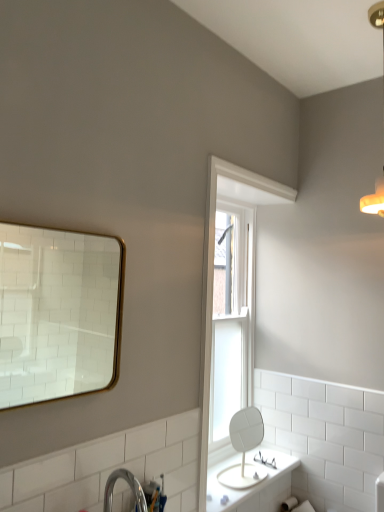
Question: Considering their positions, is warm matte light fixture at upper right located in front of or behind white painted wood window frame at upper center?

Choices:
 (A) front
 (B) behind

Answer: (A)

Question: Is point (382, 206) closer or farther from the camera than point (203, 408)?

Choices:
 (A) closer
 (B) farther

Answer: (B)

Question: Estimate the real-world distances between objects in this image. Which object is closer to the warm matte light fixture at upper right?

Choices:
 (A) gold-framed mirror at upper left, the 1th mirror when ordered from left to right
 (B) clear plastic glasses at center
 (C) white glossy mirror at center, acting as the first mirror starting from the right
 (D) clear glass window at center
 (E) white painted wood window frame at upper center

Answer: (E)

Question: Estimate the real-world distances between objects in this image. Which object is farther from the white painted wood window frame at upper center?

Choices:
 (A) clear glass window at center
 (B) warm matte light fixture at upper right
 (C) clear plastic glasses at center
 (D) white glossy mirror at center, the 1th mirror when ordered from back to front
 (E) gold-framed mirror at upper left, the 1th mirror when ordered from left to right

Answer: (E)